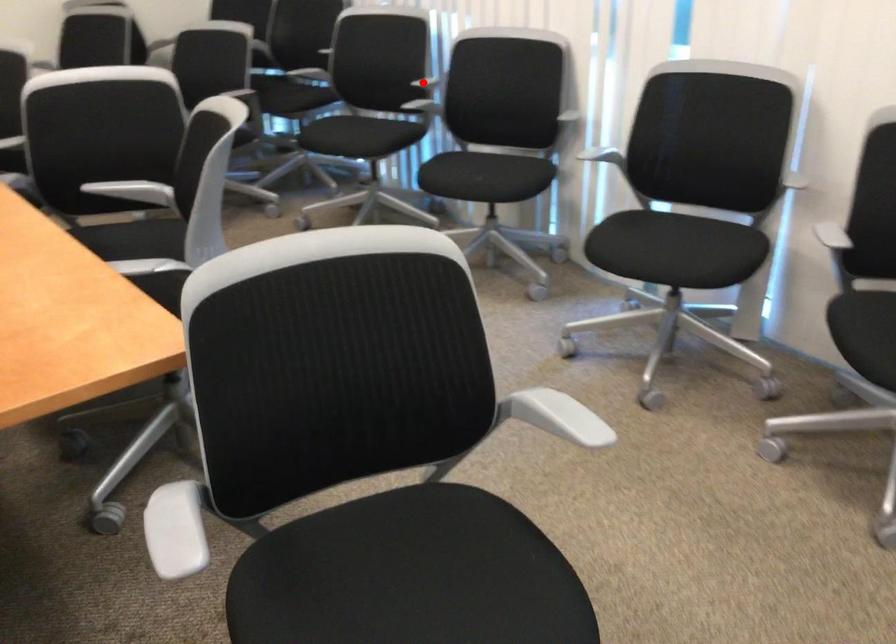
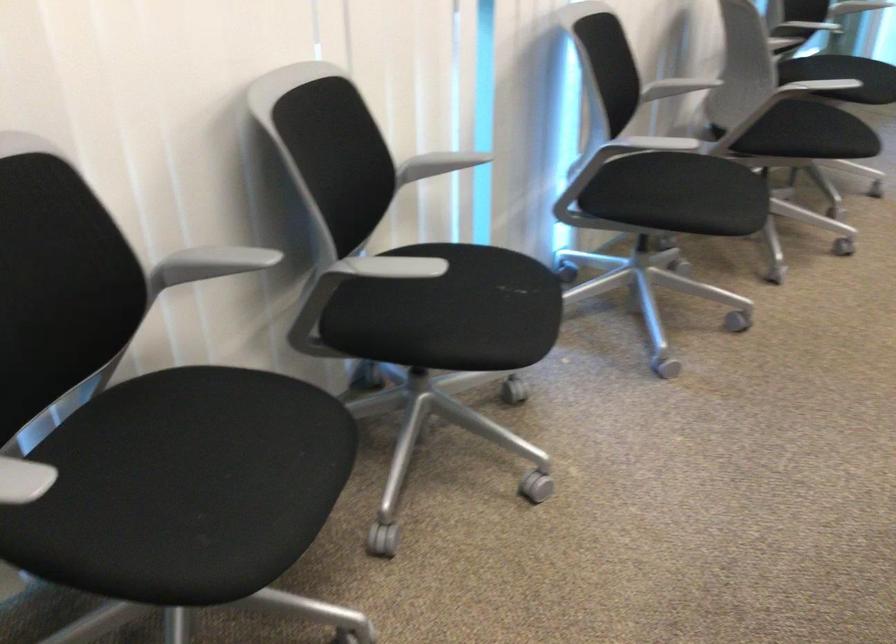
Where in the second image is the point corresponding to the highlighted location from the first image?

(211, 263)